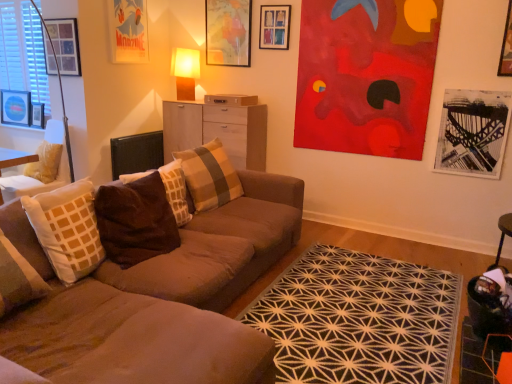
The height and width of the screenshot is (384, 512). What do you see at coordinates (62, 47) in the screenshot?
I see `wooden picture frame at upper left, the third picture frame when ordered from left to right` at bounding box center [62, 47].

This screenshot has width=512, height=384. What do you see at coordinates (159, 299) in the screenshot? I see `brown fabric couch at center` at bounding box center [159, 299].

The width and height of the screenshot is (512, 384). In order to click on brown fabric couch at center in this screenshot , I will do `click(159, 299)`.

Measure the distance between brushed metal picture frame at upper left, which ranks as the 1th picture frame in left-to-right order, and camera.

brushed metal picture frame at upper left, which ranks as the 1th picture frame in left-to-right order, and camera are 4.34 meters apart.

In order to click on brushed metal picture frame at upper left, which ranks as the 1th picture frame in left-to-right order in this screenshot , I will do `click(15, 107)`.

Measure the distance between matte brown table lamp at upper center and camera.

The depth of matte brown table lamp at upper center is 14.06 feet.

What do you see at coordinates (185, 72) in the screenshot? I see `matte brown table lamp at upper center` at bounding box center [185, 72].

You are a GUI agent. You are given a task and a screenshot of the screen. Output one action in this format:
    pyautogui.click(x=<x>, y=<y>)
    Task: Click on the white plastic window at upper left
    This screenshot has width=512, height=384.
    Given the screenshot: What is the action you would take?
    [x=23, y=51]

This screenshot has height=384, width=512. Identify the location of wooden picture frame at upper left, the sixth picture frame positioned from the right. (38, 115).

Measure the distance from wooden picture frame at upper left, the third picture frame when ordered from left to right, to brown fabric couch at center.

A distance of 2.28 meters exists between wooden picture frame at upper left, the third picture frame when ordered from left to right, and brown fabric couch at center.

Can you confirm if wooden picture frame at upper left, acting as the fifth picture frame starting from the right, is positioned to the right of brown fabric couch at center?

No, wooden picture frame at upper left, acting as the fifth picture frame starting from the right, is not to the right of brown fabric couch at center.

Considering the sizes of objects wooden picture frame at upper left, acting as the fifth picture frame starting from the right, and brown fabric couch at center in the image provided, who is taller, wooden picture frame at upper left, acting as the fifth picture frame starting from the right, or brown fabric couch at center?

Standing taller between the two is brown fabric couch at center.

Does wooden picture frame at upper left, acting as the fifth picture frame starting from the right, turn towards brown fabric couch at center?

No, wooden picture frame at upper left, acting as the fifth picture frame starting from the right, is not turned towards brown fabric couch at center.

Can you tell me how much wooden picture frame at upper center, the sixth picture frame positioned from the left, and matte wooden picture frame at upper center, the 5th picture frame positioned from the left, differ in facing direction?

0.47 degrees.

Is wooden picture frame at upper center, the sixth picture frame positioned from the left, not close to matte wooden picture frame at upper center, the 3th picture frame viewed from the right?

wooden picture frame at upper center, the sixth picture frame positioned from the left, is near matte wooden picture frame at upper center, the 3th picture frame viewed from the right, not far away.

Which object is further away from the camera taking this photo, wooden picture frame at upper center, the sixth picture frame positioned from the left, or matte wooden picture frame at upper center, the 5th picture frame positioned from the left?

matte wooden picture frame at upper center, the 5th picture frame positioned from the left.

Is wooden picture frame at upper left, placed as the 2th picture frame when sorted from left to right, completely or partially inside wooden picture frame at upper center, the sixth picture frame positioned from the left?

No, wooden picture frame at upper left, placed as the 2th picture frame when sorted from left to right, is not surrounded by wooden picture frame at upper center, the sixth picture frame positioned from the left.

Is wooden picture frame at upper center, the sixth picture frame positioned from the left, closer to camera compared to wooden picture frame at upper left, placed as the 2th picture frame when sorted from left to right?

That is True.

Considering the sizes of objects wooden picture frame at upper center, acting as the 2th picture frame starting from the right, and wooden picture frame at upper left, placed as the 2th picture frame when sorted from left to right, in the image provided, who is smaller, wooden picture frame at upper center, acting as the 2th picture frame starting from the right, or wooden picture frame at upper left, placed as the 2th picture frame when sorted from left to right,?

With smaller size is wooden picture frame at upper left, placed as the 2th picture frame when sorted from left to right.

Is wooden picture frame at upper center, the sixth picture frame positioned from the left, positioned with its back to wooden picture frame at upper left, the sixth picture frame positioned from the right?

That's not correct — wooden picture frame at upper center, the sixth picture frame positioned from the left, is not looking away from wooden picture frame at upper left, the sixth picture frame positioned from the right.

Is wooden picture frame at upper center, acting as the 2th picture frame starting from the right, not inside velvet cushioned chair at left?

Yes, wooden picture frame at upper center, acting as the 2th picture frame starting from the right, is located beyond the bounds of velvet cushioned chair at left.

From a real-world perspective, who is located higher, wooden picture frame at upper center, acting as the 2th picture frame starting from the right, or velvet cushioned chair at left?

From a 3D spatial view, wooden picture frame at upper center, acting as the 2th picture frame starting from the right, is above.

Can you confirm if wooden picture frame at upper center, acting as the 2th picture frame starting from the right, is shorter than velvet cushioned chair at left?

Yes, wooden picture frame at upper center, acting as the 2th picture frame starting from the right, is shorter than velvet cushioned chair at left.

From the picture: How distant is wooden picture frame at upper center, the sixth picture frame positioned from the left, from velvet cushioned chair at left?

They are 7.48 feet apart.

Is brown velvety pillow at center, acting as the 2th pillow starting from the front, wider or thinner than wooden picture frame at upper left, the sixth picture frame positioned from the right?

Clearly, brown velvety pillow at center, acting as the 2th pillow starting from the front, has more width compared to wooden picture frame at upper left, the sixth picture frame positioned from the right.

Is point (179, 170) closer or farther from the camera than point (39, 114)?

Point (179, 170) is closer to the camera than point (39, 114).

From the image's perspective, is brown velvety pillow at center, placed as the second pillow when sorted from back to front, beneath wooden picture frame at upper left, the sixth picture frame positioned from the right?

Indeed, from the image's perspective, brown velvety pillow at center, placed as the second pillow when sorted from back to front, is shown beneath wooden picture frame at upper left, the sixth picture frame positioned from the right.

Is brown velvety pillow at center, acting as the 2th pillow starting from the front, not near wooden picture frame at upper left, the sixth picture frame positioned from the right?

Yes, brown velvety pillow at center, acting as the 2th pillow starting from the front, is far from wooden picture frame at upper left, the sixth picture frame positioned from the right.

From a real-world perspective, is wooden picture frame at upper left, placed as the 2th picture frame when sorted from left to right, located beneath light wood cabinet at center?

Actually, wooden picture frame at upper left, placed as the 2th picture frame when sorted from left to right, is physically above light wood cabinet at center in the real world.

Does wooden picture frame at upper left, the sixth picture frame positioned from the right, have a larger size compared to light wood cabinet at center?

No.

Visually, is wooden picture frame at upper left, placed as the 2th picture frame when sorted from left to right, positioned to the left or to the right of light wood cabinet at center?

Clearly, wooden picture frame at upper left, placed as the 2th picture frame when sorted from left to right, is on the left of light wood cabinet at center in the image.

From the image's perspective, between velvet cushioned chair at left and matte wooden picture frame at upper center, the 3th picture frame viewed from the right, which one is located above?

matte wooden picture frame at upper center, the 3th picture frame viewed from the right.

Does velvet cushioned chair at left have a smaller size compared to matte wooden picture frame at upper center, the 3th picture frame viewed from the right?

No, velvet cushioned chair at left is not smaller than matte wooden picture frame at upper center, the 3th picture frame viewed from the right.

Based on the photo, which object is closer to the camera taking this photo, velvet cushioned chair at left or matte wooden picture frame at upper center, the 3th picture frame viewed from the right?

velvet cushioned chair at left is more forward.

How many degrees apart are the facing directions of velvet cushioned chair at left and matte wooden picture frame at upper center, the 5th picture frame positioned from the left?

They differ by 10.4 degrees in their facing directions.

This screenshot has height=384, width=512. I want to click on studio couch that appears below the wooden picture frame at upper left, acting as the fifth picture frame starting from the right (from a real-world perspective), so click(x=159, y=299).

Which picture frame is the 1st one when counting from the back of the wooden picture frame at upper center, acting as the 2th picture frame starting from the right? Please provide its 2D coordinates.

[(228, 32)]

When comparing their distances from plaid fabric pillow at center, which appears as the third pillow when viewed from the front, does brown fabric couch at center or black and white photograph of bridge at upper right, the 7th picture frame viewed from the left, seem further?

black and white photograph of bridge at upper right, the 7th picture frame viewed from the left, lies further to plaid fabric pillow at center, which appears as the third pillow when viewed from the front, than the other object.

Estimate the real-world distances between objects in this image. Which object is closer to wooden picture frame at upper center, acting as the 2th picture frame starting from the right, velvet cushioned chair at left or matte brown table lamp at upper center?

matte brown table lamp at upper center.

Which object lies nearer to the anchor point wooden picture frame at upper center, acting as the 2th picture frame starting from the right, velvet cushioned chair at left or light wood cabinet at center?

light wood cabinet at center.

Considering their positions, is plaid fabric pillow at center, which appears as the third pillow when viewed from the front, positioned further to brushed metal picture frame at upper left, which ranks as the 7th picture frame in right-to-left order, than wooden picture frame at upper left, the third picture frame when ordered from left to right?

Among the two, plaid fabric pillow at center, which appears as the third pillow when viewed from the front, is located further to brushed metal picture frame at upper left, which ranks as the 7th picture frame in right-to-left order.

Based on their spatial positions, is wooden picture frame at upper left, placed as the 2th picture frame when sorted from left to right, or black and white photograph of bridge at upper right, marked as the 1th picture frame in a right-to-left arrangement, further from matte paper poster at upper left, which appears as the 4th picture frame when viewed from the right?

The object further to matte paper poster at upper left, which appears as the 4th picture frame when viewed from the right, is black and white photograph of bridge at upper right, marked as the 1th picture frame in a right-to-left arrangement.

Considering their positions, is wooden picture frame at upper left, the sixth picture frame positioned from the right, positioned closer to brown fabric couch at center than black and white photograph of bridge at upper right, the 7th picture frame viewed from the left?

black and white photograph of bridge at upper right, the 7th picture frame viewed from the left, lies closer to brown fabric couch at center than the other object.

Estimate the real-world distances between objects in this image. Which object is closer to orange fabric swivel chair at lower right, velvet cushioned chair at left or brown velvety pillow at center, acting as the 2th pillow starting from the front?

The object closer to orange fabric swivel chair at lower right is brown velvety pillow at center, acting as the 2th pillow starting from the front.

Which object lies further to the anchor point wooden picture frame at upper left, acting as the fifth picture frame starting from the right, wooden picture frame at upper center, the sixth picture frame positioned from the left, or black and white photograph of bridge at upper right, the 7th picture frame viewed from the left?

black and white photograph of bridge at upper right, the 7th picture frame viewed from the left, is further to wooden picture frame at upper left, acting as the fifth picture frame starting from the right.

I want to click on cabinetry between wooden picture frame at upper left, placed as the 2th picture frame when sorted from left to right, and orange fabric swivel chair at lower right from left to right, so click(217, 131).

The height and width of the screenshot is (384, 512). What are the coordinates of `table lamp located between velvet cushioned chair at left and orange fabric swivel chair at lower right in the left-right direction` in the screenshot? It's located at (185, 72).

Where is `chair situated between white plastic window at upper left and black and white photograph of bridge at upper right, marked as the 1th picture frame in a right-to-left arrangement, from left to right`? The width and height of the screenshot is (512, 384). chair situated between white plastic window at upper left and black and white photograph of bridge at upper right, marked as the 1th picture frame in a right-to-left arrangement, from left to right is located at coordinates (39, 168).

Identify the location of swivel chair located between light wood cabinet at center and black and white photograph of bridge at upper right, the 7th picture frame viewed from the left, in the left-right direction. (499, 361).